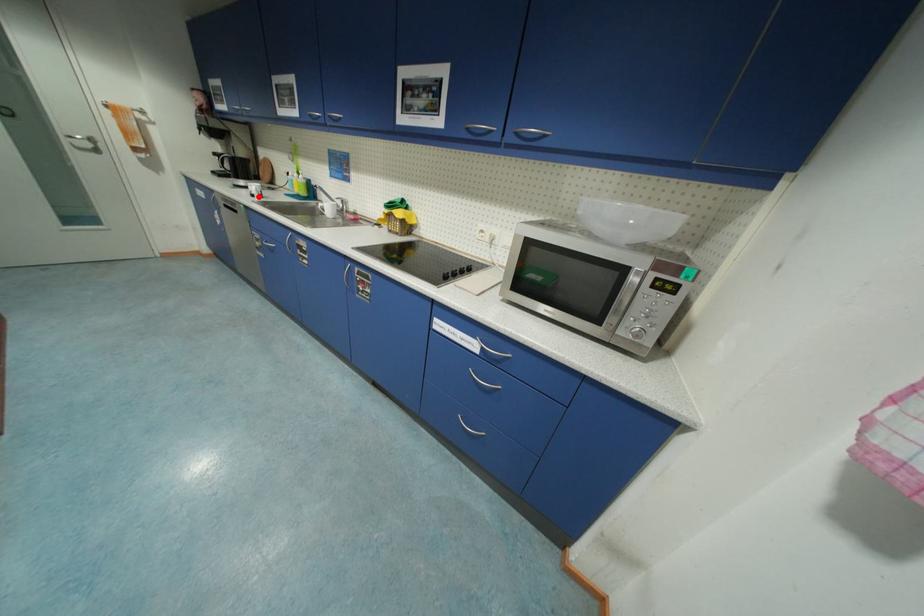
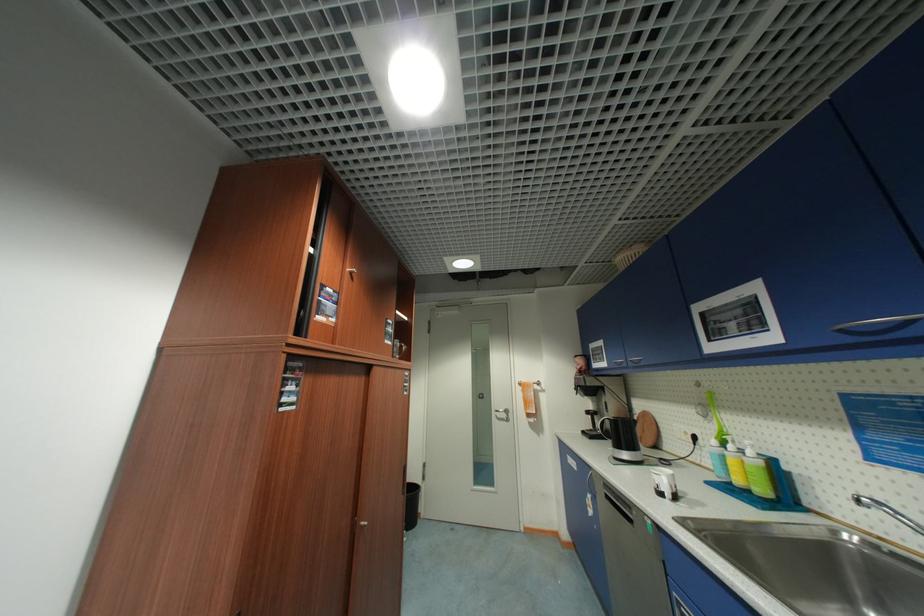
Question: I am providing you with two images of the same scene from different viewpoints. In image1, a red point is highlighted. Considering the same 3D point in image2, which of the following is correct?

Choices:
 (A) It is closer
 (B) It is farther

Answer: (B)